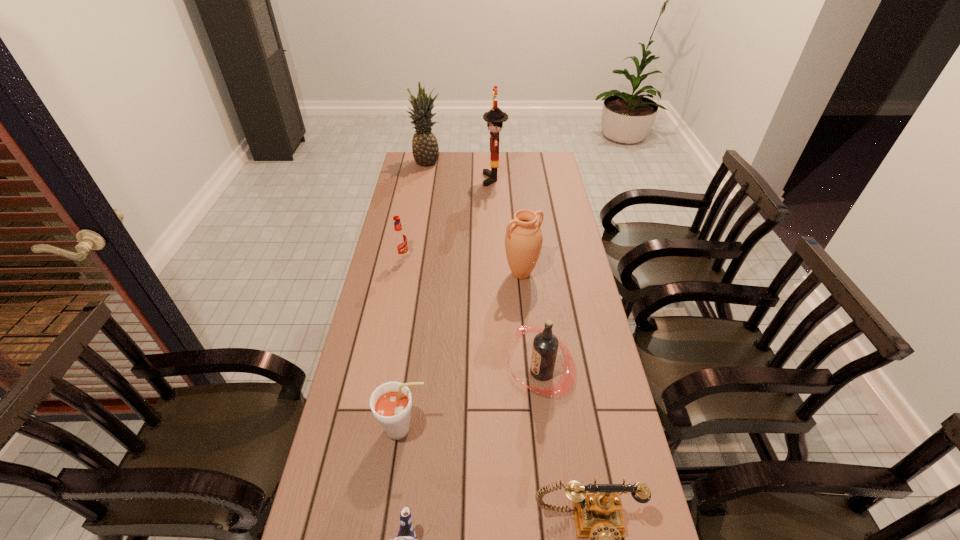
Identify the location of free space between the nearest root beer and the fourth tallest object. The width and height of the screenshot is (960, 540). (472, 401).

Identify which object is located as the seventh nearest to the telephone. Please provide its 2D coordinates. Your answer should be formatted as a tuple, i.e. [(x, y)], where the tuple contains the x and y coordinates of a point satisfying the conditions above.

[(425, 150)]

Locate which object is the seventh closest to the leftmost root beer. Please provide its 2D coordinates. Your answer should be formatted as a tuple, i.e. [(x, y)], where the tuple contains the x and y coordinates of a point satisfying the conditions above.

[(598, 516)]

Select which root beer is the third closest to the seventh shortest object. Please provide its 2D coordinates. Your answer should be formatted as a tuple, i.e. [(x, y)], where the tuple contains the x and y coordinates of a point satisfying the conditions above.

[(391, 403)]

Where is `root beer that stands as the third closest to the telephone`? root beer that stands as the third closest to the telephone is located at coordinates (399, 237).

Identify the location of free space in the image that satisfies the following two spatial constraints: 1. on the back side of the fourth farthest object; 2. on the front-facing side of the nutcracker. (512, 179).

Find the location of a particular element. This screenshot has width=960, height=540. free space that satisfies the following two spatial constraints: 1. on the front-facing side of the nutcracker; 2. on the front side of the farthest root beer is located at coordinates (497, 258).